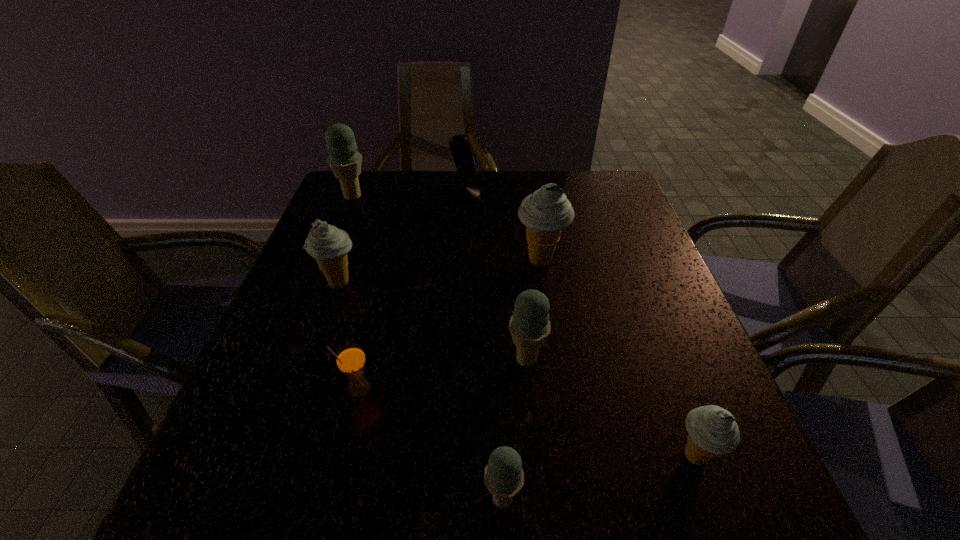
At what (x,y) coordinates should I click in order to perform the action: click on the smallest beige icecream. Please return your answer as a coordinate pair (x, y). This screenshot has width=960, height=540. Looking at the image, I should click on (712, 430).

This screenshot has width=960, height=540. I want to click on the rightmost beige icecream, so click(x=712, y=430).

Locate an element on the screen. This screenshot has height=540, width=960. the nearest object is located at coordinates (504, 476).

At what (x,y) coordinates should I click in order to perform the action: click on the nearest blue ice cream. Please return your answer as a coordinate pair (x, y). Looking at the image, I should click on (504, 476).

Locate an element on the screen. vacant space located 0.160m on the front of the biggest beige icecream is located at coordinates click(552, 331).

This screenshot has height=540, width=960. Identify the location of free space located 0.230m on the right of the farthest ice cream. pyautogui.click(x=449, y=196).

The width and height of the screenshot is (960, 540). Find the location of `vacant area located 0.400m on the stand of the black microphone`. vacant area located 0.400m on the stand of the black microphone is located at coordinates (619, 194).

This screenshot has height=540, width=960. I want to click on free space located on the back of the second smallest beige icecream, so click(x=361, y=220).

Where is `vacant space located 0.050m on the back of the fifth farthest object`? The width and height of the screenshot is (960, 540). vacant space located 0.050m on the back of the fifth farthest object is located at coordinates coord(523,325).

The height and width of the screenshot is (540, 960). I want to click on free point located 0.050m on the left of the sixth farthest object, so click(x=319, y=390).